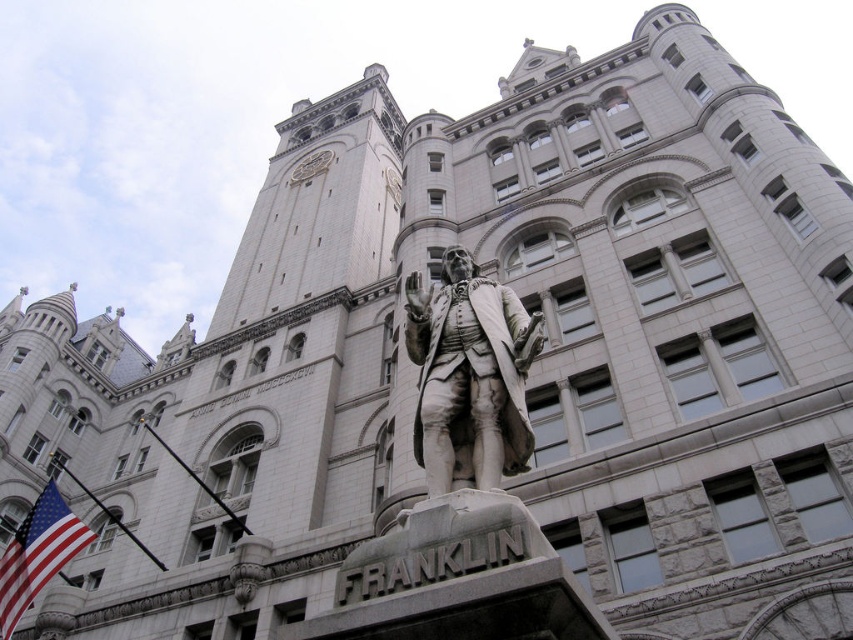
Question: Does white marble statue at center have a larger size compared to red fabric flag at lower left?

Choices:
 (A) no
 (B) yes

Answer: (A)

Question: Which of the following is the farthest from the observer?

Choices:
 (A) red fabric flag at lower left
 (B) white marble statue at center

Answer: (A)

Question: Is white marble statue at center above red fabric flag at lower left?

Choices:
 (A) no
 (B) yes

Answer: (B)

Question: Is white marble statue at center to the left of red fabric flag at lower left from the viewer's perspective?

Choices:
 (A) no
 (B) yes

Answer: (A)

Question: Which object is farther from the camera taking this photo?

Choices:
 (A) red fabric flag at lower left
 (B) white marble statue at center

Answer: (A)